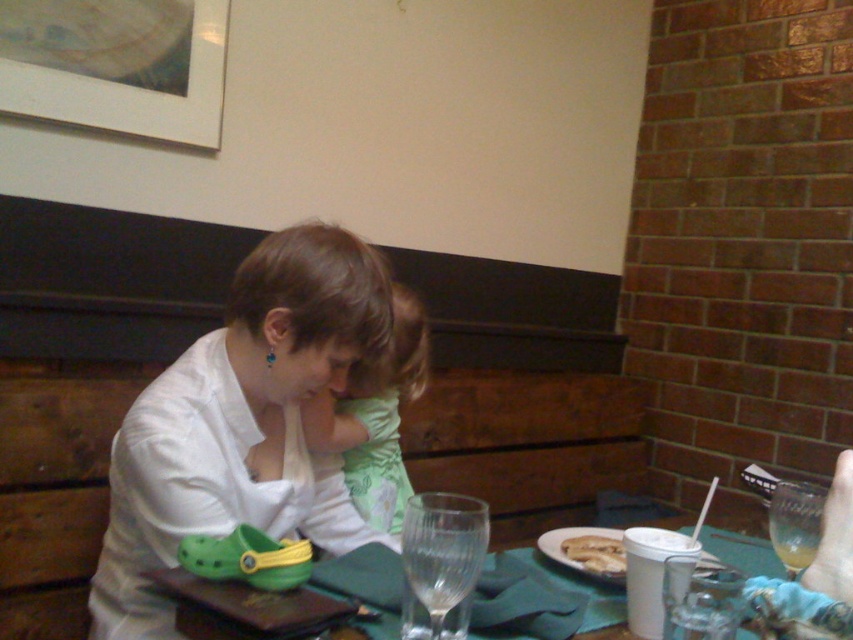
Question: Among these objects, which one is nearest to the camera?

Choices:
 (A) golden crispy bread at lower center
 (B) green fabric shirt at center
 (C) green rubber clog at lower left

Answer: (B)

Question: Is white matte shirt at center smaller than green rubber clog at lower left?

Choices:
 (A) no
 (B) yes

Answer: (A)

Question: Based on their relative distances, which object is nearer to the golden crispy bread at lower center?

Choices:
 (A) white matte shirt at center
 (B) green rubber clog at lower left
 (C) green fabric shirt at center

Answer: (B)

Question: Is white matte shirt at center positioned behind green rubber clog at lower left?

Choices:
 (A) no
 (B) yes

Answer: (A)

Question: Based on their relative distances, which object is farther from the white matte shirt at center?

Choices:
 (A) green fabric shirt at center
 (B) golden crispy bread at lower center

Answer: (B)

Question: Can you confirm if green fabric shirt at center is bigger than golden crispy bread at lower center?

Choices:
 (A) no
 (B) yes

Answer: (B)